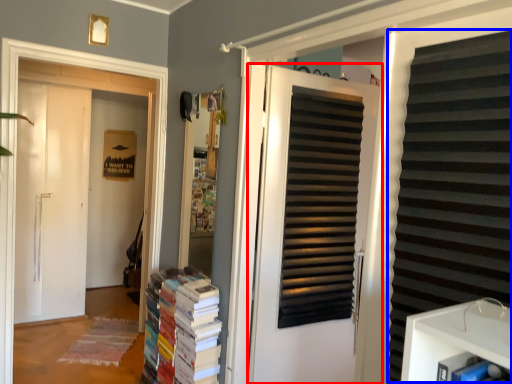
Question: Among these objects, which one is nearest to the camera, door (highlighted by a red box) or shutter (highlighted by a blue box)?

Choices:
 (A) door
 (B) shutter

Answer: (B)